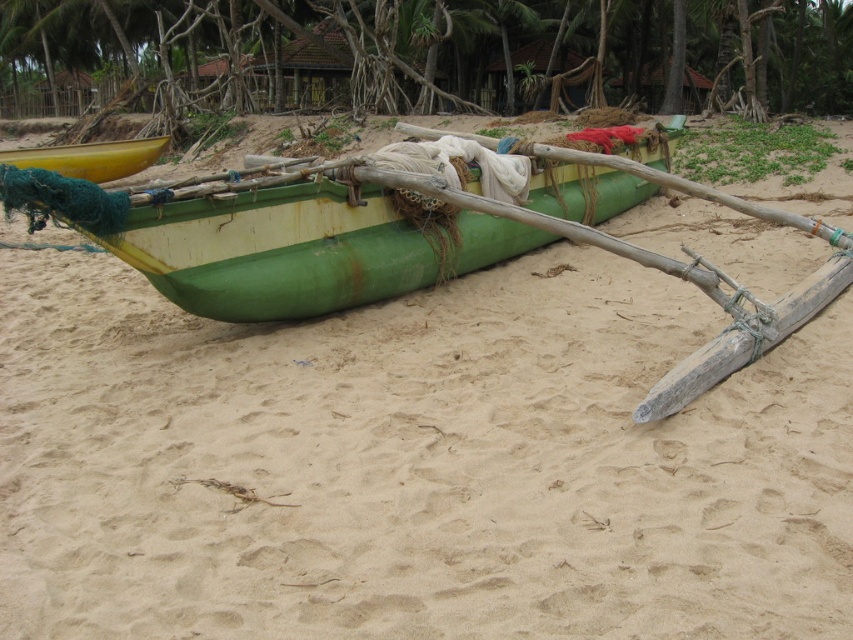
You are a marine biologist who needs to move a 10 meter long research boat from the green matte boat at center to the yellow matte canoe at left. Is there enough space to maneuver the boat between them?

The distance between the green matte boat at center and the yellow matte canoe at left is 12.18 meters. Since the research boat is 10 meters long, there is sufficient space to maneuver it between them.

You are standing on the beach and see the green matte boat at center and the yellow matte canoe at left. Which one is closer to the water?

The yellow matte canoe at left is closer to the water because it is positioned to the left of the green matte boat at center, which is further to the right.